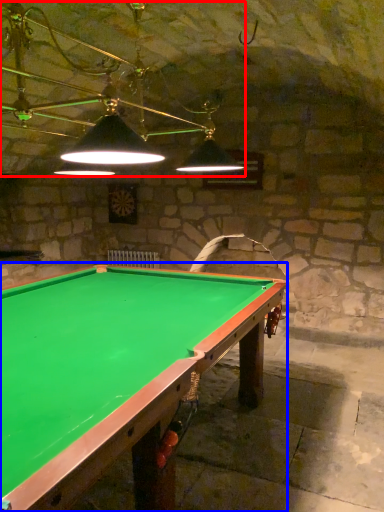
Question: Which point is closer to the camera, lamp (highlighted by a red box) or billiard table (highlighted by a blue box)?

Choices:
 (A) lamp
 (B) billiard table

Answer: (B)